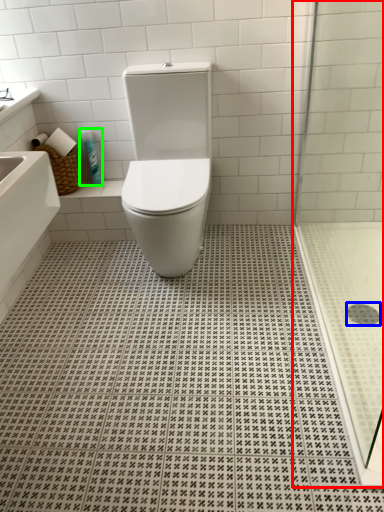
Question: Estimate the real-world distances between objects in this image. Which object is farther from shower door (highlighted by a red box), drain (highlighted by a blue box) or toiletry (highlighted by a green box)?

Choices:
 (A) drain
 (B) toiletry

Answer: (B)